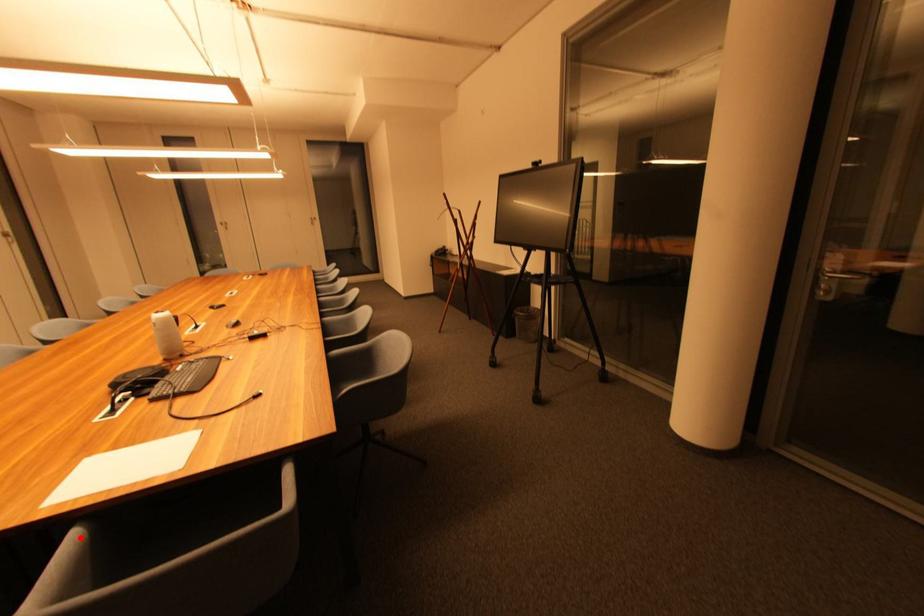
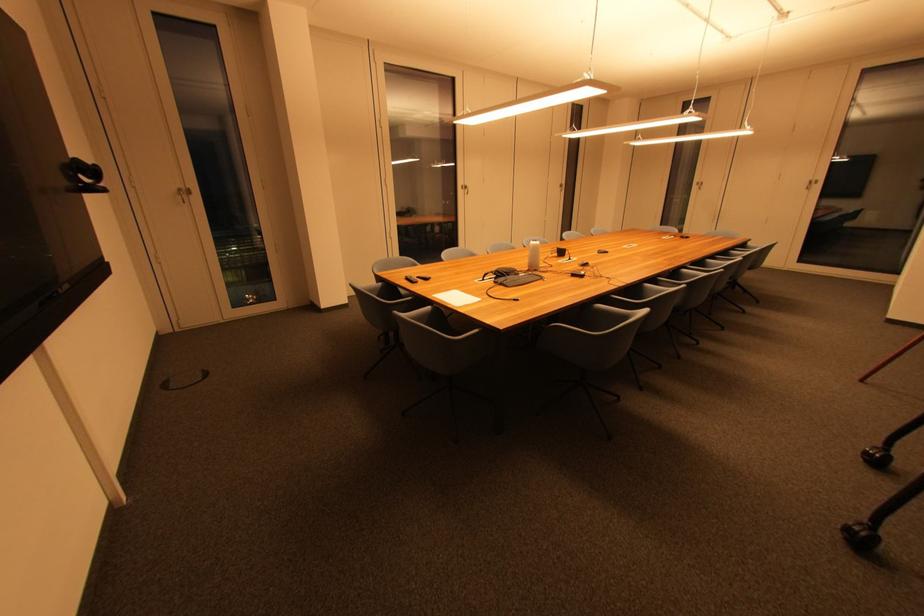
The point at the highlighted location is marked in the first image. Where is the corresponding point in the second image?

(433, 310)